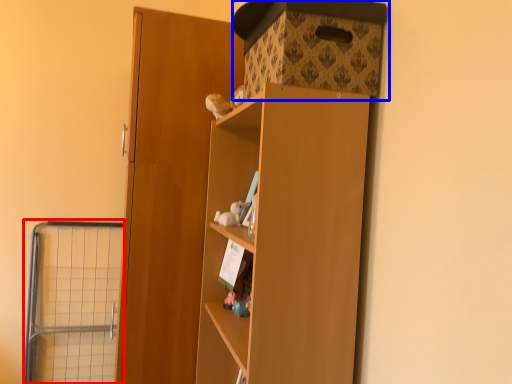
Question: Which object is closer to the camera taking this photo, cage (highlighted by a red box) or storage box (highlighted by a blue box)?

Choices:
 (A) cage
 (B) storage box

Answer: (B)